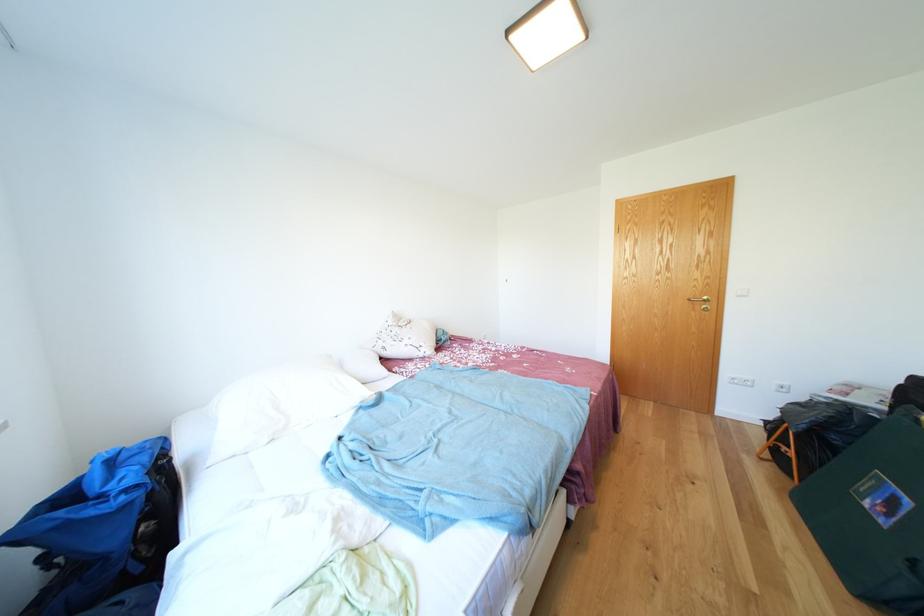
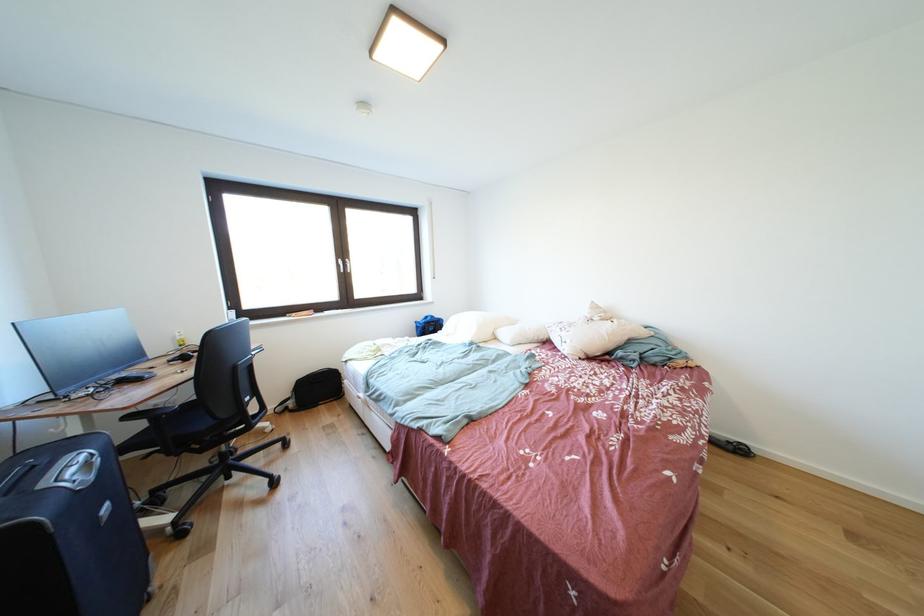
Find the pixel in the second image that matches pixel 416 346 in the first image.

(572, 338)